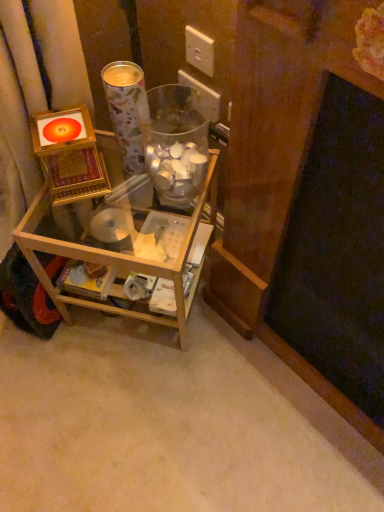
Find the location of `vacant space in front of clear wood shelf at center`. vacant space in front of clear wood shelf at center is located at coordinates (143, 395).